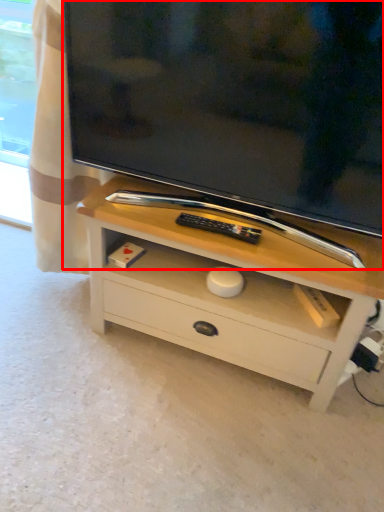
Question: Where is television (annotated by the red box) located in relation to chest of drawers in the image?

Choices:
 (A) right
 (B) left

Answer: (B)